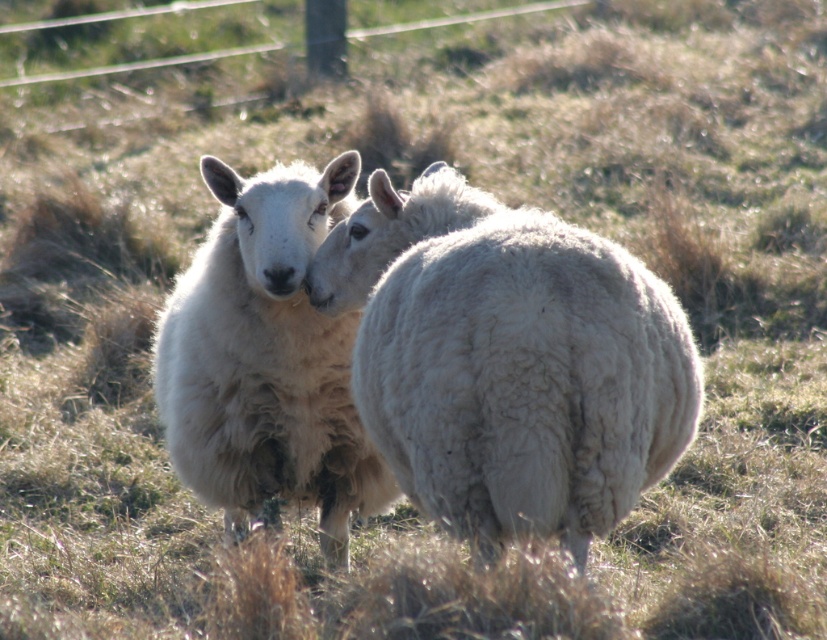
From the picture: Is white woolly sheep at center further to camera compared to white woolen sheep at center?

No, it is not.

Can you confirm if white woolly sheep at center is taller than white woolen sheep at center?

In fact, white woolly sheep at center may be shorter than white woolen sheep at center.

Which is behind, point (657, 344) or point (201, 465)?

The point (201, 465) is behind.

The width and height of the screenshot is (827, 640). Identify the location of white woolly sheep at center. (508, 360).